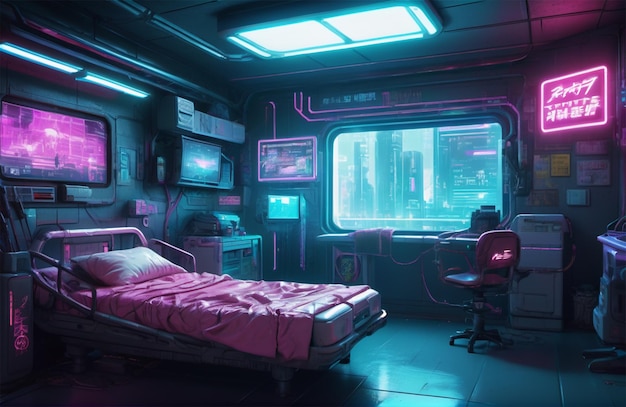
Where is `digitalized image of inside a room`? digitalized image of inside a room is located at coordinates pos(505,83).